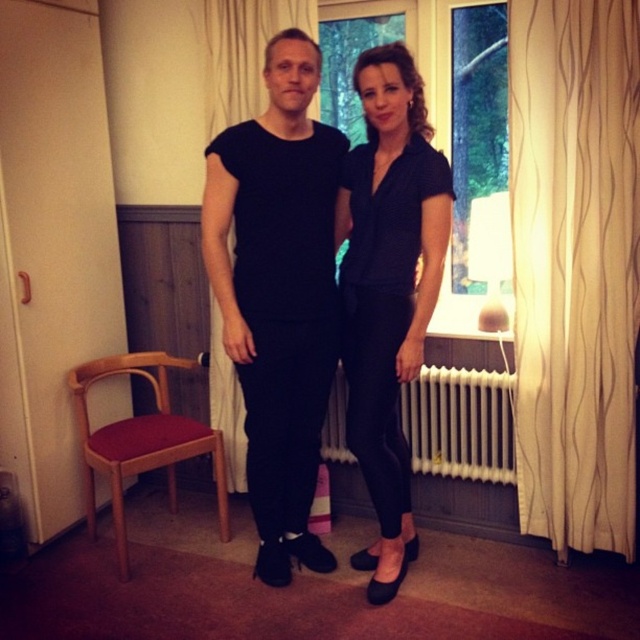
Which is in front, point (291, 4) or point (333, 400)?

Point (291, 4) is more forward.

Does white sheer curtain at center have a larger size compared to white metallic radiator at lower center?

Correct, white sheer curtain at center is larger in size than white metallic radiator at lower center.

Who is more distant from viewer, (228, 422) or (497, 433)?

Positioned behind is point (228, 422).

The width and height of the screenshot is (640, 640). I want to click on white sheer curtain at center, so pos(243,52).

Between point (410, 198) and point (406, 513), which one is positioned in front?

Positioned in front is point (410, 198).

Who is positioned more to the right, black matte pants at center or matte black blouse at center?

From the viewer's perspective, matte black blouse at center appears more on the right side.

Is point (248, 458) positioned behind point (387, 326)?

Yes, it is behind point (387, 326).

I want to click on black matte pants at center, so click(x=387, y=289).

Between point (620, 449) and point (284, 550), which one is positioned behind?

Point (284, 550)

Does beige textured curtain at right have a greater height compared to black matte pants at center?

Yes, beige textured curtain at right is taller than black matte pants at center.

At what (x,y) coordinates should I click in order to perform the action: click on beige textured curtain at right. Please return your answer as a coordinate pair (x, y). The height and width of the screenshot is (640, 640). Looking at the image, I should click on (576, 266).

At what (x,y) coordinates should I click in order to perform the action: click on beige textured curtain at right. Please return your answer as a coordinate pair (x, y). Image resolution: width=640 pixels, height=640 pixels. Looking at the image, I should click on (576, 266).